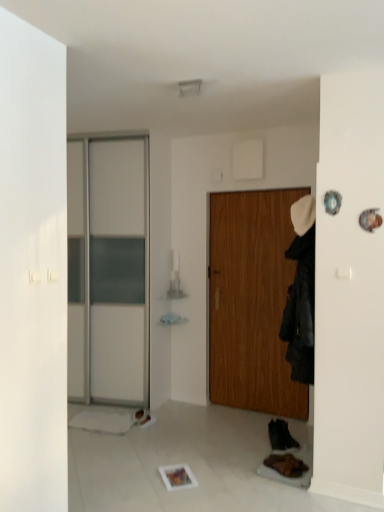
Where is `vacant area situated below white leather shoe at lower center, which ranks as the 1th shoe in back-to-front order (from a real-world perspective)`? The image size is (384, 512). vacant area situated below white leather shoe at lower center, which ranks as the 1th shoe in back-to-front order (from a real-world perspective) is located at coordinates (152, 420).